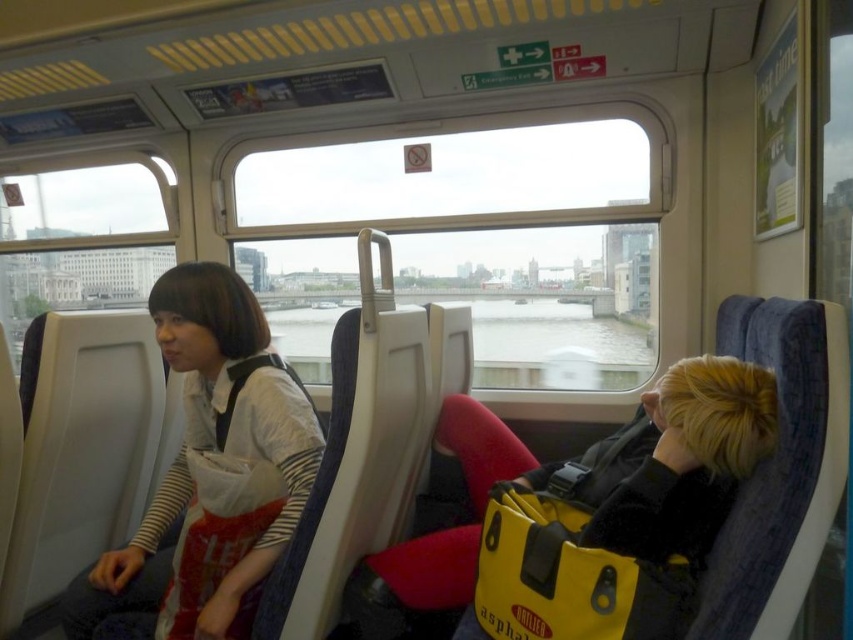
Question: Which of the following is the farthest from the observer?

Choices:
 (A) (276, 403)
 (B) (668, 428)

Answer: (A)

Question: Which point is closer to the camera taking this photo?

Choices:
 (A) (753, 444)
 (B) (317, 424)

Answer: (A)

Question: Observing the image, what is the correct spatial positioning of yellow waterproof bag at center in reference to white matte shirt at left?

Choices:
 (A) left
 (B) right

Answer: (B)

Question: Can you confirm if yellow waterproof bag at center is wider than white matte shirt at left?

Choices:
 (A) yes
 (B) no

Answer: (A)

Question: Does yellow waterproof bag at center appear over white matte shirt at left?

Choices:
 (A) yes
 (B) no

Answer: (B)

Question: Among these objects, which one is nearest to the camera?

Choices:
 (A) white matte shirt at left
 (B) yellow waterproof bag at center

Answer: (B)